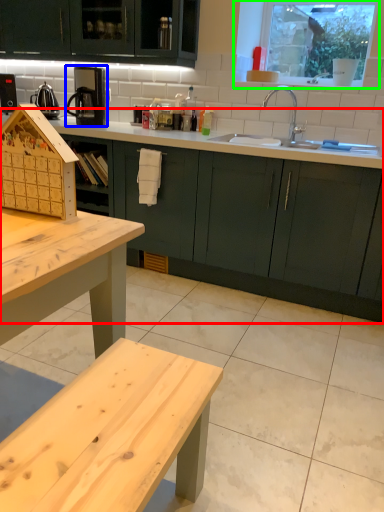
Question: Which is farther away from countertop (highlighted by a red box)? coffee machine (highlighted by a blue box) or window (highlighted by a green box)?

Choices:
 (A) coffee machine
 (B) window

Answer: (B)